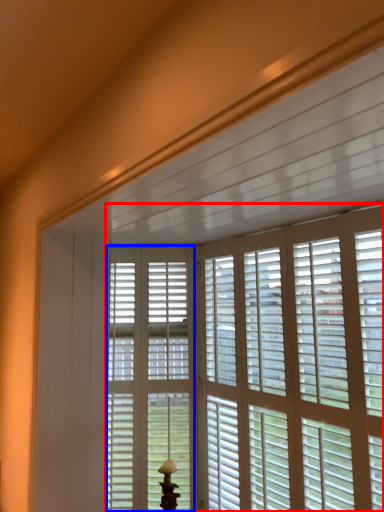
Question: Which object appears closest to the camera in this image, window blind (highlighted by a red box) or screen door (highlighted by a blue box)?

Choices:
 (A) window blind
 (B) screen door

Answer: (A)